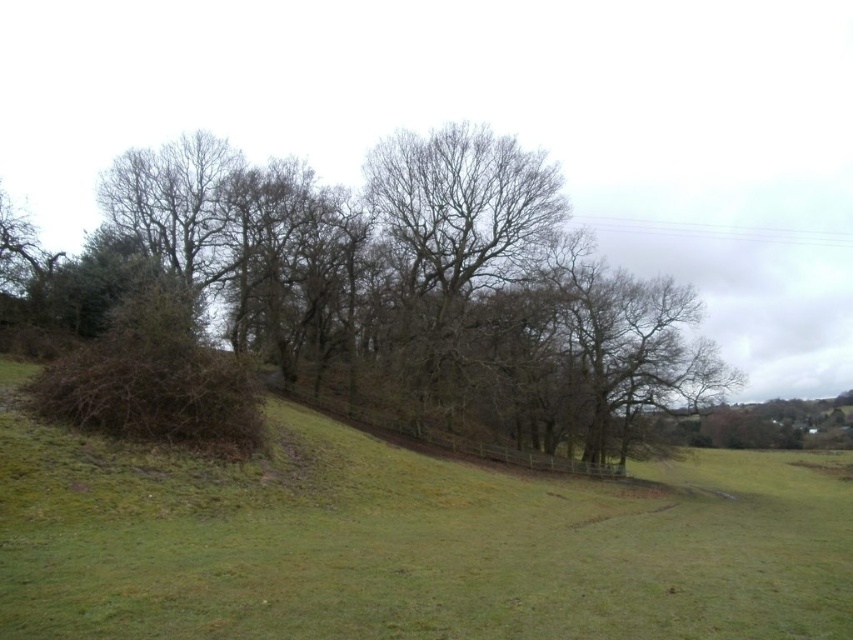
Question: Observing the image, what is the correct spatial positioning of bare branches at center in reference to green grassy hill at center?

Choices:
 (A) right
 (B) left

Answer: (B)

Question: Which of the following is the closest to the observer?

Choices:
 (A) (653, 477)
 (B) (544, 310)

Answer: (B)

Question: Is bare branches at center below green grassy hill at center?

Choices:
 (A) no
 (B) yes

Answer: (A)

Question: Which of the following is the farthest from the observer?

Choices:
 (A) (659, 582)
 (B) (306, 342)

Answer: (B)

Question: Can you confirm if bare branches at center is thinner than green grassy hill at center?

Choices:
 (A) yes
 (B) no

Answer: (B)